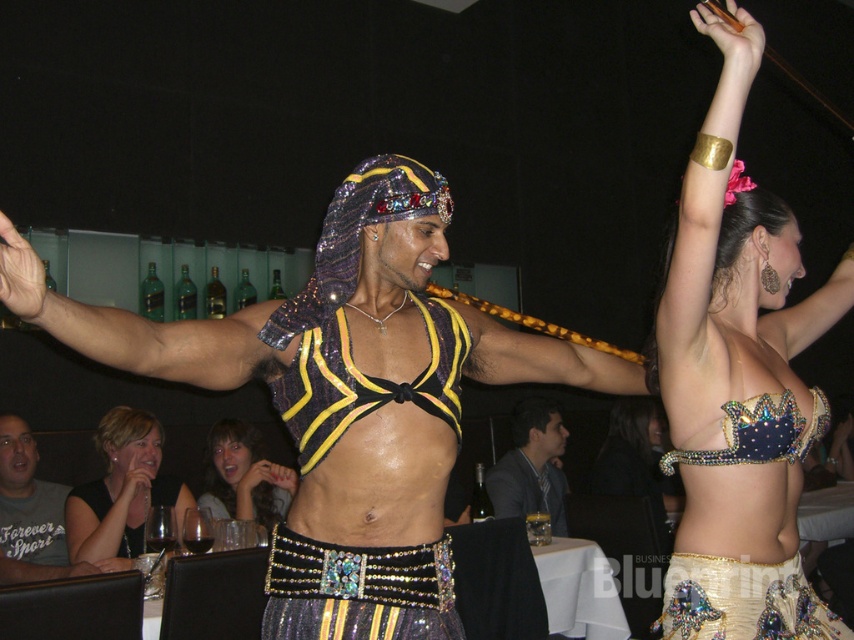
You are a photographer at the belly dancing performance and want to capture a clear shot of the shiny sequined top at center and the shiny black hair at center. Since the venue is dimly lit, you need to adjust your camera settings to focus on both objects. Which object should you prioritize focusing on to ensure it appears sharp in the photo?

The shiny sequined top at center is in front of the shiny black hair at center, so you should prioritize focusing on the shiny sequined top at center to ensure it appears sharp in the photo.

You are a photographer in the audience at this belly dancing performance. You want to capture a photo that shows both the shiny sequined top at center and the shiny black hair at center. Which object should you focus on first to ensure both are in frame?

The shiny sequined top at center is taller than the shiny black hair at center, so focus on the shiny sequined top at center first to ensure both are in frame.